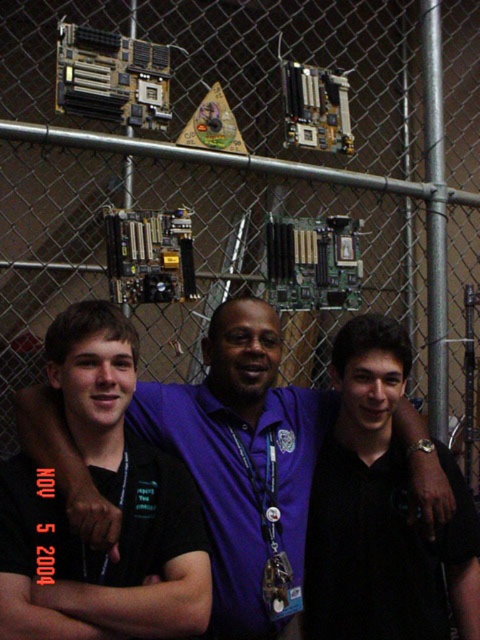
Can you confirm if purple shirt at center is positioned to the right of black matte shirt at center?

Yes, purple shirt at center is to the right of black matte shirt at center.

Image resolution: width=480 pixels, height=640 pixels. What do you see at coordinates (240, 452) in the screenshot? I see `purple shirt at center` at bounding box center [240, 452].

At what (x,y) coordinates should I click in order to perform the action: click on purple shirt at center. Please return your answer as a coordinate pair (x, y). The height and width of the screenshot is (640, 480). Looking at the image, I should click on (240, 452).